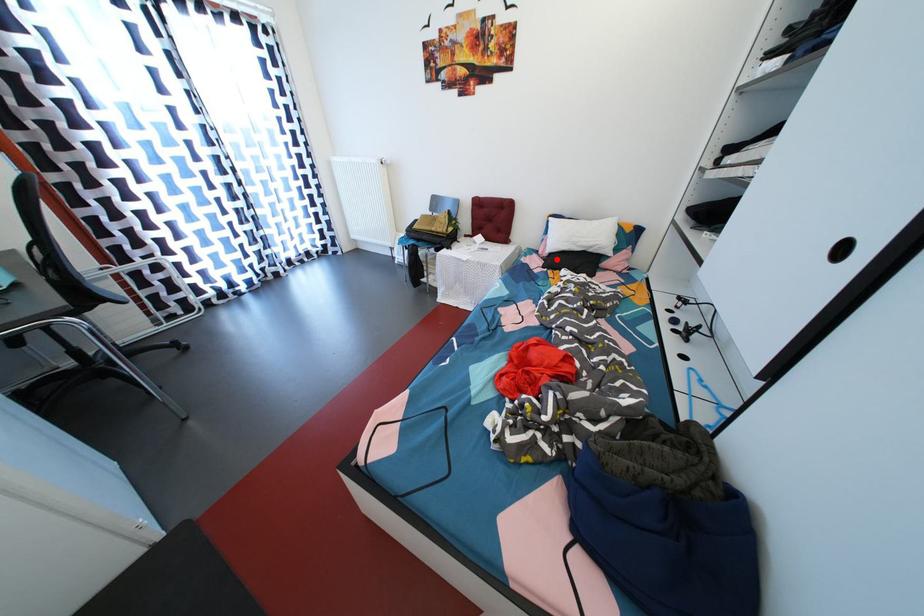
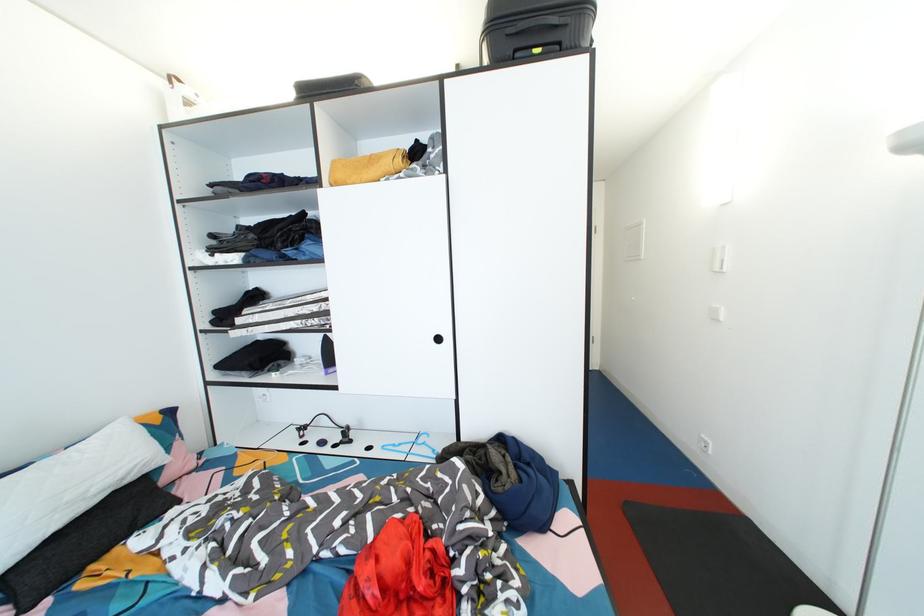
The point at the highlighted location is marked in the first image. Where is the corresponding point in the second image?

(8, 583)